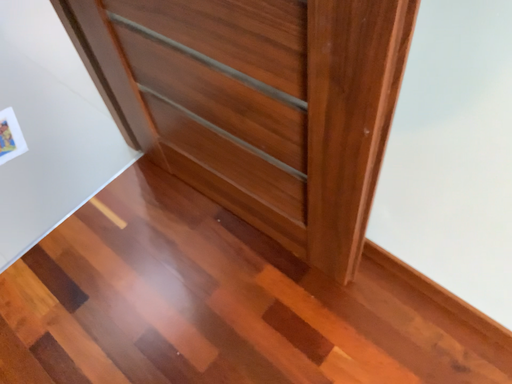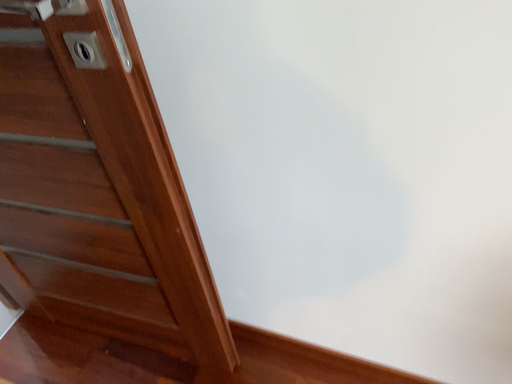
Question: How did the camera likely rotate when shooting the video?

Choices:
 (A) rotated upward
 (B) rotated downward

Answer: (A)